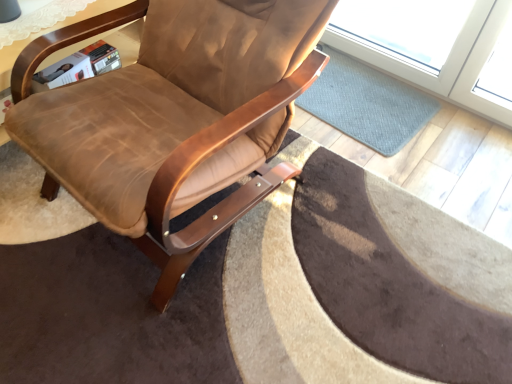
Question: Is wooden table at upper left positioned behind blue textured mat at center?

Choices:
 (A) yes
 (B) no

Answer: (B)

Question: Considering the relative sizes of wooden table at upper left and blue textured mat at center in the image provided, is wooden table at upper left shorter than blue textured mat at center?

Choices:
 (A) yes
 (B) no

Answer: (B)

Question: Is wooden table at upper left at the right side of blue textured mat at center?

Choices:
 (A) yes
 (B) no

Answer: (B)

Question: Is wooden table at upper left aimed at blue textured mat at center?

Choices:
 (A) yes
 (B) no

Answer: (B)

Question: Considering the relative sizes of wooden table at upper left and blue textured mat at center in the image provided, is wooden table at upper left bigger than blue textured mat at center?

Choices:
 (A) no
 (B) yes

Answer: (B)

Question: In the image, is blue textured mat at center on the left side or the right side of brown leather chair at center?

Choices:
 (A) right
 (B) left

Answer: (A)

Question: Is blue textured mat at center wider or thinner than brown leather chair at center?

Choices:
 (A) thin
 (B) wide

Answer: (A)

Question: From the image's perspective, is blue textured mat at center located above or below brown leather chair at center?

Choices:
 (A) below
 (B) above

Answer: (B)

Question: Is blue textured mat at center inside the boundaries of brown leather chair at center, or outside?

Choices:
 (A) inside
 (B) outside

Answer: (B)

Question: Considering their positions, is wooden table at upper left located in front of or behind blue textured mat at center?

Choices:
 (A) behind
 (B) front

Answer: (B)

Question: Based on their positions, is wooden table at upper left located to the left or right of blue textured mat at center?

Choices:
 (A) left
 (B) right

Answer: (A)

Question: Is wooden table at upper left wider or thinner than blue textured mat at center?

Choices:
 (A) thin
 (B) wide

Answer: (B)

Question: From the image's perspective, is wooden table at upper left above or below blue textured mat at center?

Choices:
 (A) below
 (B) above

Answer: (A)

Question: Based on their positions, is brown leather chair at center located to the left or right of wooden table at upper left?

Choices:
 (A) right
 (B) left

Answer: (A)

Question: From the image's perspective, relative to wooden table at upper left, is brown leather chair at center above or below?

Choices:
 (A) below
 (B) above

Answer: (A)